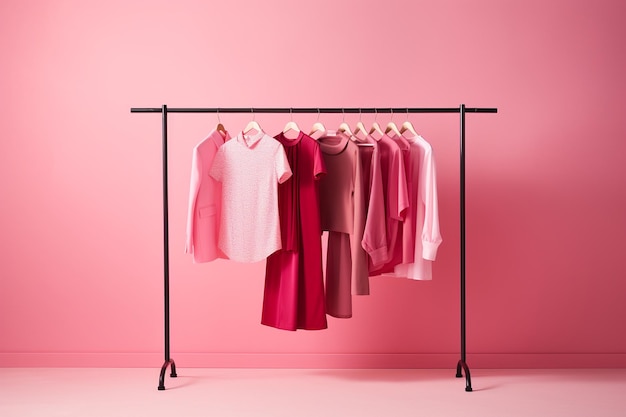
Image resolution: width=626 pixels, height=417 pixels. I want to click on hooks, so click(217, 106), click(249, 107), click(290, 110), click(313, 112), click(339, 112), click(357, 110), click(377, 109), click(393, 109), click(409, 110).